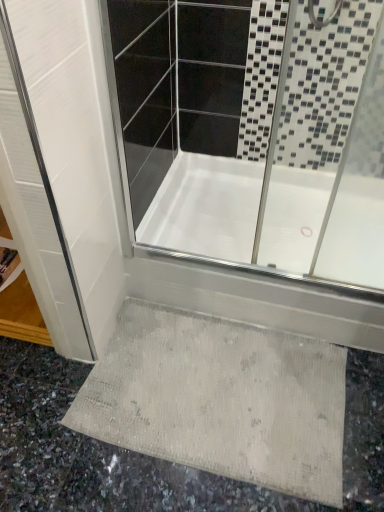
What do you see at coordinates (220, 400) in the screenshot?
I see `beige textured bath mat at lower center` at bounding box center [220, 400].

The height and width of the screenshot is (512, 384). I want to click on beige textured bath mat at lower center, so click(x=220, y=400).

Find the location of a particular element. beige textured bath mat at lower center is located at coordinates (220, 400).